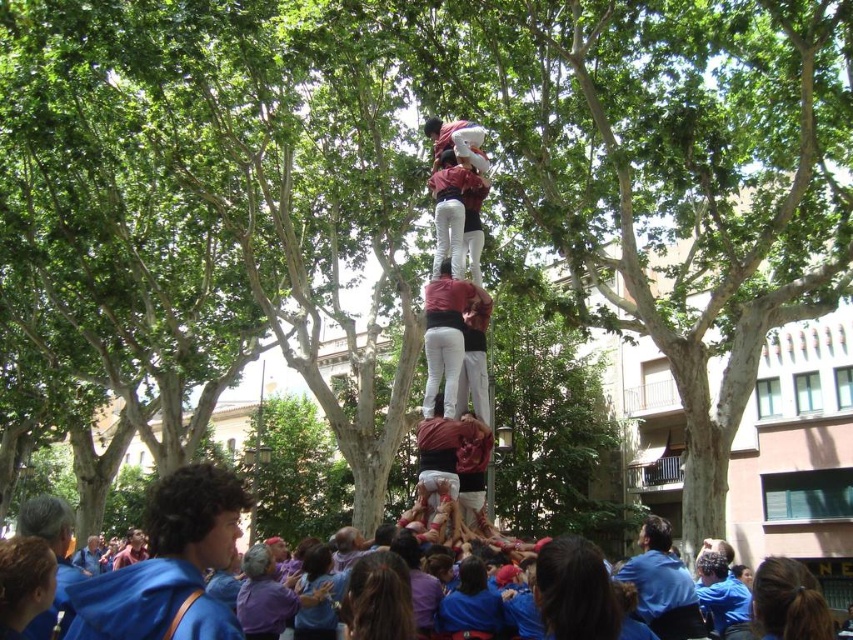
Describe the element at coordinates (448, 333) in the screenshot. I see `smooth white pants at center` at that location.

Between smooth white pants at center and matte red shirt at center, which one has less height?

matte red shirt at center

The width and height of the screenshot is (853, 640). I want to click on smooth white pants at center, so click(x=448, y=333).

How far apart are blue fabric crowd at lower center and matte red shirt at center?

The distance of blue fabric crowd at lower center from matte red shirt at center is 24.39 meters.

Does blue fabric crowd at lower center have a smaller size compared to matte red shirt at center?

Incorrect, blue fabric crowd at lower center is not smaller in size than matte red shirt at center.

The height and width of the screenshot is (640, 853). Find the location of `blue fabric crowd at lower center`. blue fabric crowd at lower center is located at coordinates (167, 564).

This screenshot has height=640, width=853. I want to click on blue fabric crowd at lower center, so click(x=167, y=564).

Is blue fabric crowd at lower center above smooth white pants at center?

Incorrect, blue fabric crowd at lower center is not positioned above smooth white pants at center.

Where is `blue fabric crowd at lower center`? The height and width of the screenshot is (640, 853). blue fabric crowd at lower center is located at coordinates (167, 564).

The image size is (853, 640). What are the coordinates of `blue fabric crowd at lower center` in the screenshot? It's located at tap(167, 564).